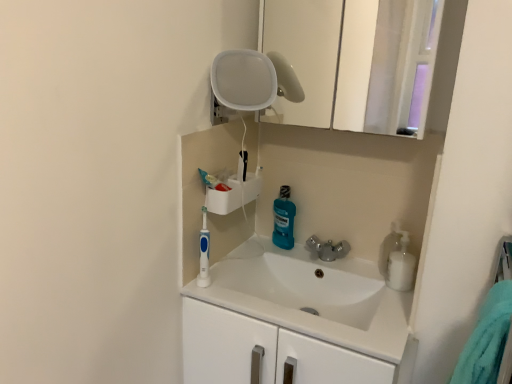
You are a GUI agent. You are given a task and a screenshot of the screen. Output one action in this format:
    pyautogui.click(x=<x>, y=<y>)
    Task: Click on the vacant space to the left of blue glossy mouthwash at center, positioned as the second cleaning product in right-to-left order
    
    Given the screenshot: What is the action you would take?
    pyautogui.click(x=244, y=250)